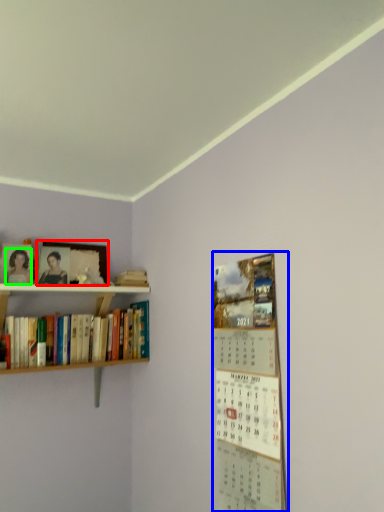
Question: Which object is positioned closest to picture frame (highlighted by a red box)? Select from bulletin board (highlighted by a blue box) and person (highlighted by a green box).

Choices:
 (A) bulletin board
 (B) person

Answer: (B)